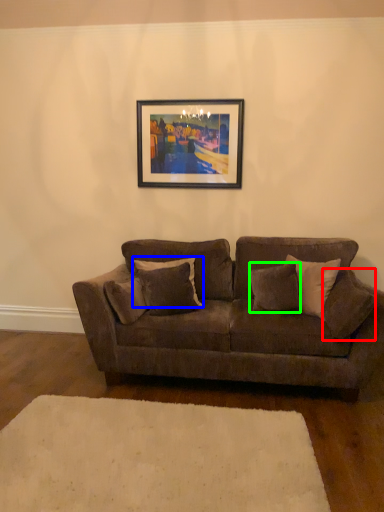
Question: Which object is positioned farthest from pillow (highlighted by a red box)? Select from pillow (highlighted by a blue box) and pillow (highlighted by a green box).

Choices:
 (A) pillow
 (B) pillow

Answer: (A)